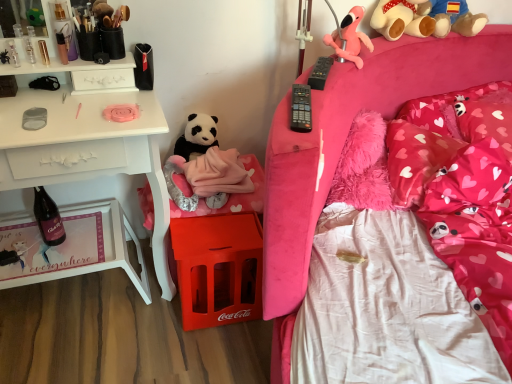
Question: Is black plush teddy bear at center, which appears as the first teddy bear when ordered from the bottom, to the right of pink plush teddy bear at upper right, the 1th teddy bear when ordered from right to left, from the viewer's perspective?

Choices:
 (A) yes
 (B) no

Answer: (B)

Question: From a real-world perspective, is black plush teddy bear at center, which is counted as the first teddy bear, starting from the left, positioned over pink plush teddy bear at upper right, positioned as the 3th teddy bear in bottom-to-top order, based on gravity?

Choices:
 (A) no
 (B) yes

Answer: (A)

Question: Is black plush teddy bear at center, placed as the third teddy bear when sorted from right to left, outside pink plush teddy bear at upper right, positioned as the 3th teddy bear in bottom-to-top order?

Choices:
 (A) no
 (B) yes

Answer: (B)

Question: Can you confirm if black plush teddy bear at center, which is counted as the first teddy bear, starting from the left, is smaller than pink plush teddy bear at upper right, positioned as the 3th teddy bear in bottom-to-top order?

Choices:
 (A) no
 (B) yes

Answer: (B)

Question: Considering the relative positions of black plush teddy bear at center, placed as the third teddy bear when sorted from right to left, and pink plush teddy bear at upper right, which is the third teddy bear in left-to-right order, in the image provided, is black plush teddy bear at center, placed as the third teddy bear when sorted from right to left, in front of pink plush teddy bear at upper right, which is the third teddy bear in left-to-right order,?

Choices:
 (A) no
 (B) yes

Answer: (A)

Question: Considering the relative sizes of black plush teddy bear at center, which is counted as the first teddy bear, starting from the left, and pink plush teddy bear at upper right, which is the third teddy bear in left-to-right order, in the image provided, is black plush teddy bear at center, which is counted as the first teddy bear, starting from the left, wider than pink plush teddy bear at upper right, which is the third teddy bear in left-to-right order,?

Choices:
 (A) no
 (B) yes

Answer: (A)

Question: From the image's perspective, is pink plush toy at upper right, the second teddy bear when ordered from right to left, under pink fluffy pillow at upper right, the 3th pillow in the left-to-right sequence?

Choices:
 (A) yes
 (B) no

Answer: (B)

Question: Is pink plush toy at upper right, the second teddy bear when ordered from right to left, closer to the viewer compared to pink fluffy pillow at upper right, placed as the 1th pillow when sorted from right to left?

Choices:
 (A) no
 (B) yes

Answer: (B)

Question: From the image's perspective, would you say pink plush toy at upper right, acting as the second teddy bear starting from the bottom, is positioned over pink fluffy pillow at upper right, placed as the 1th pillow when sorted from right to left?

Choices:
 (A) yes
 (B) no

Answer: (A)

Question: Can you confirm if pink plush toy at upper right, the 2th teddy bear from the top, is thinner than pink fluffy pillow at upper right, the 3th pillow in the left-to-right sequence?

Choices:
 (A) no
 (B) yes

Answer: (B)

Question: Are pink plush toy at upper right, acting as the second teddy bear starting from the bottom, and pink fluffy pillow at upper right, the 3th pillow in the left-to-right sequence, beside each other?

Choices:
 (A) yes
 (B) no

Answer: (B)

Question: Is pink plush toy at upper right, the second teddy bear when ordered from right to left, oriented towards pink fluffy pillow at upper right, the 3th pillow in the left-to-right sequence?

Choices:
 (A) no
 (B) yes

Answer: (A)

Question: Is clear plastic bottles at upper left, the 3th toiletry when ordered from right to left, to the left of metallic gold lip balm at upper left, arranged as the second toiletry when viewed from the right, from the viewer's perspective?

Choices:
 (A) no
 (B) yes

Answer: (B)